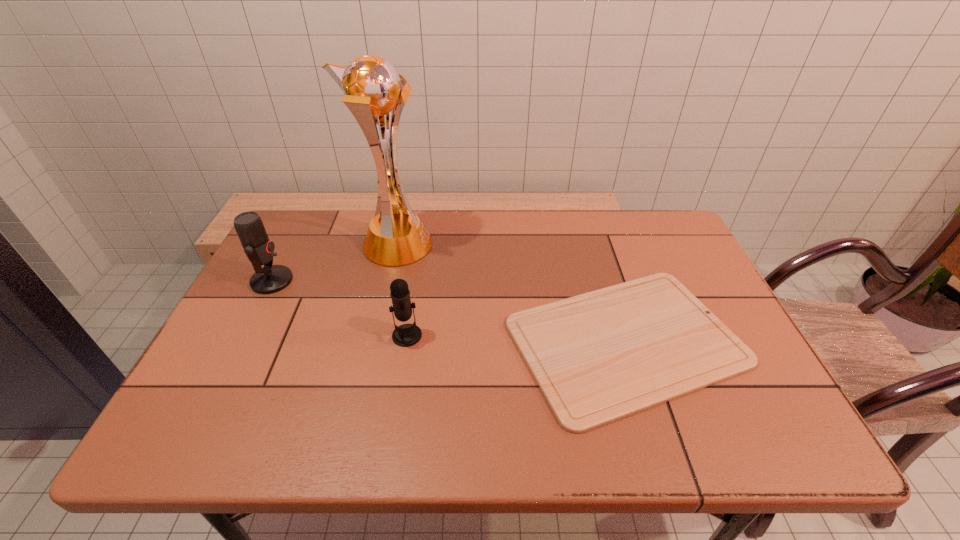
In order to click on empty space that is in between the leftmost object and the trophy in this screenshot , I will do `click(334, 263)`.

Select which object appears as the closest to the tallest object. Please provide its 2D coordinates. Your answer should be formatted as a tuple, i.e. [(x, y)], where the tuple contains the x and y coordinates of a point satisfying the conditions above.

[(259, 249)]

Where is `object identified as the third closest to the second shortest object`? Image resolution: width=960 pixels, height=540 pixels. object identified as the third closest to the second shortest object is located at coordinates (259, 249).

Find the location of a particular element. vacant space that satisfies the following two spatial constraints: 1. on the back side of the shortest object; 2. on the side of the farther microphone with the red ring is located at coordinates (607, 281).

Find the location of `vacant area in the image that satisfies the following two spatial constraints: 1. on the side of the leftmost object with the red ring; 2. on the right side of the second shortest object`. vacant area in the image that satisfies the following two spatial constraints: 1. on the side of the leftmost object with the red ring; 2. on the right side of the second shortest object is located at coordinates (243, 336).

The width and height of the screenshot is (960, 540). In order to click on free point that satisfies the following two spatial constraints: 1. on the side of the taller microphone with the red ring; 2. on the right side of the rightmost object in this screenshot , I will do `click(240, 341)`.

Locate an element on the screen. vacant region that satisfies the following two spatial constraints: 1. on the side of the chopping board with the red ring; 2. on the right side of the taller microphone is located at coordinates (240, 341).

Find the location of a particular element. vacant position in the image that satisfies the following two spatial constraints: 1. on the front-facing side of the shortest object; 2. on the left side of the trophy is located at coordinates (373, 341).

Identify the location of blank area in the image that satisfies the following two spatial constraints: 1. on the back side of the nearer microphone; 2. on the side of the third shortest object with the red ring. (416, 281).

This screenshot has width=960, height=540. What are the coordinates of `vacant space that satisfies the following two spatial constraints: 1. on the back side of the rightmost object; 2. on the side of the leftmost object with the red ring` in the screenshot? It's located at (607, 281).